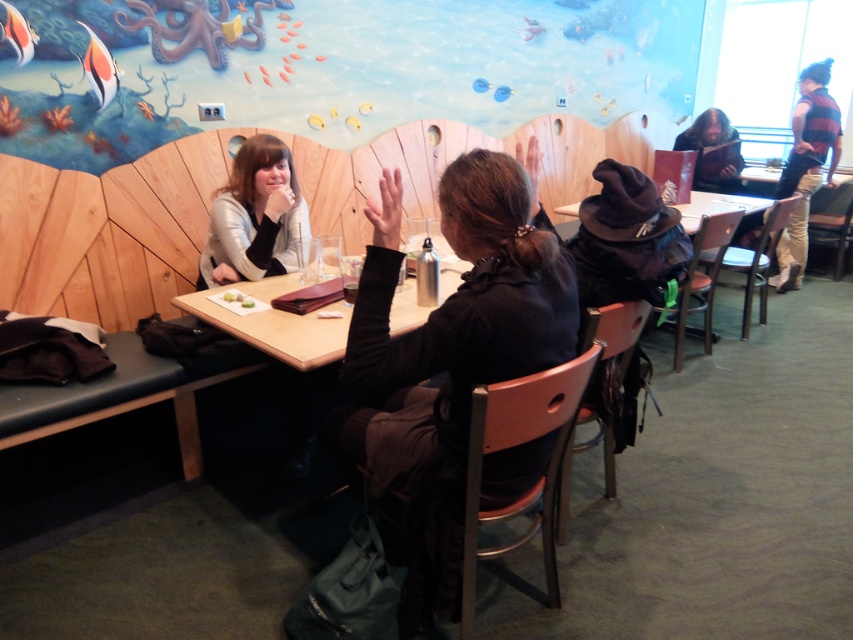
Question: Which of the following is the farthest from the observer?

Choices:
 (A) (814, 150)
 (B) (213, 280)
 (C) (289, 324)

Answer: (A)

Question: Can you confirm if wooden table at center is bigger than striped wool sweater at upper right?

Choices:
 (A) no
 (B) yes

Answer: (A)

Question: Is matte silver jacket at left positioned before striped wool sweater at upper right?

Choices:
 (A) yes
 (B) no

Answer: (A)

Question: Based on their relative distances, which object is farther from the striped wool sweater at upper right?

Choices:
 (A) wooden table at center
 (B) matte silver jacket at left

Answer: (B)

Question: Is wooden table at center wider than striped wool sweater at upper right?

Choices:
 (A) no
 (B) yes

Answer: (B)

Question: Which point appears farthest from the camera in this image?

Choices:
 (A) (218, 240)
 (B) (260, 330)
 (C) (788, 184)

Answer: (C)